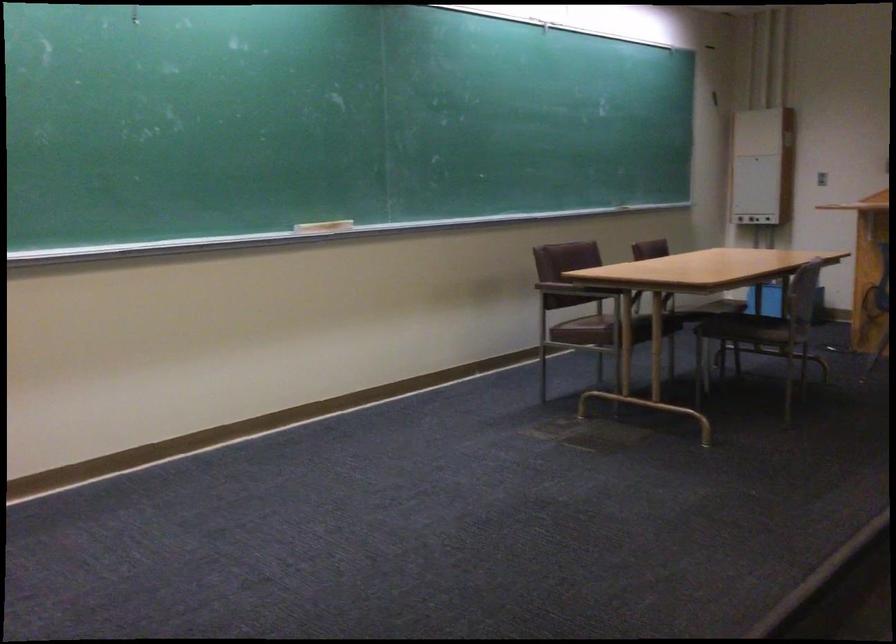
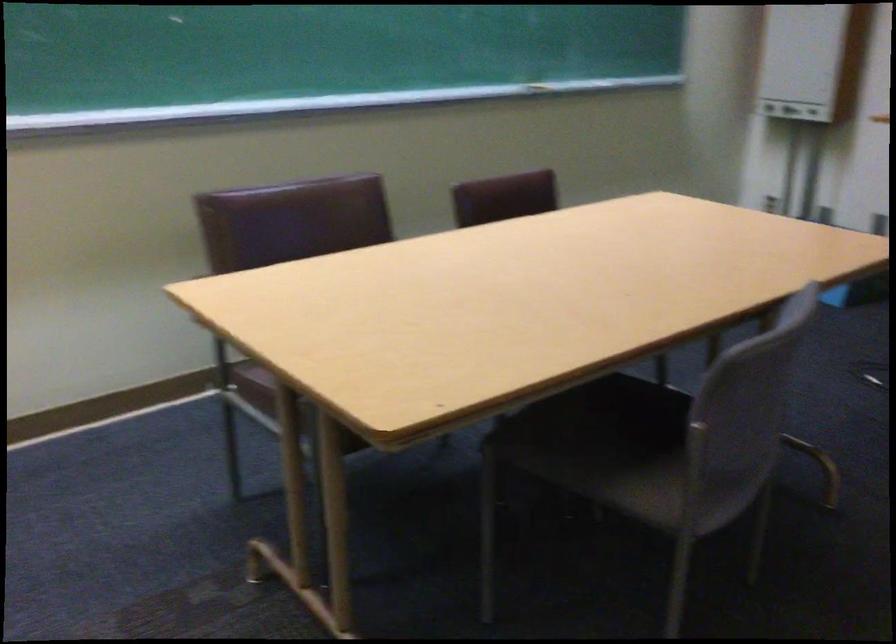
Which direction would the cameraman need to move to produce the second image?

The cameraman walked toward right, forward.